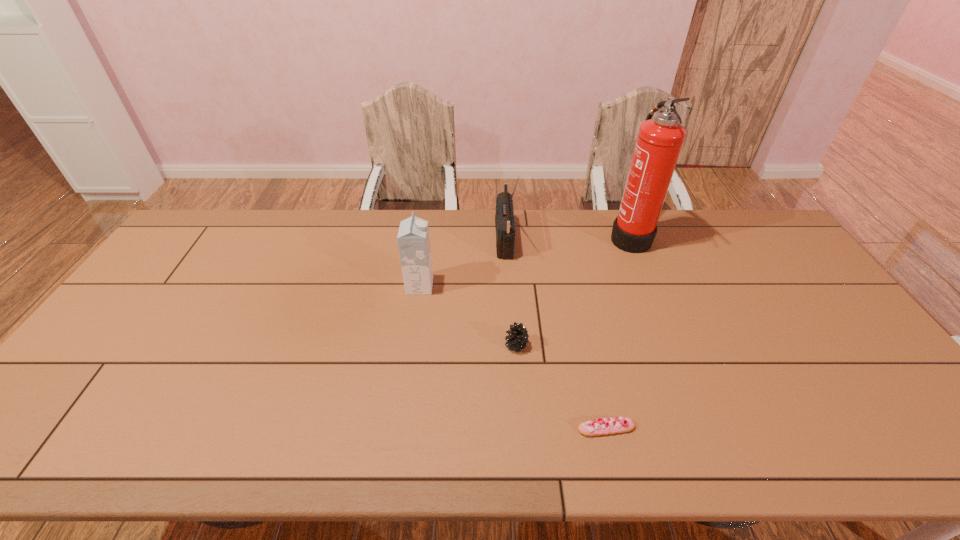
You are a GUI agent. You are given a task and a screenshot of the screen. Output one action in this format:
    pyautogui.click(x=<x>, y=<y>)
    Task: Click on the rightmost object
    The height and width of the screenshot is (540, 960).
    Given the screenshot: What is the action you would take?
    pyautogui.click(x=659, y=142)

The height and width of the screenshot is (540, 960). What are the coordinates of `the tallest object` in the screenshot? It's located at (659, 142).

What are the coordinates of `the fourth shortest object` in the screenshot? It's located at (504, 219).

Find the location of a particular element. This screenshot has width=960, height=540. carton is located at coordinates (413, 238).

This screenshot has height=540, width=960. Find the location of `the leftmost object`. the leftmost object is located at coordinates (413, 238).

At what (x,y) coordinates should I click in order to perform the action: click on pinecone. Please return your answer as a coordinate pair (x, y). The width and height of the screenshot is (960, 540). Looking at the image, I should click on (517, 338).

The width and height of the screenshot is (960, 540). I want to click on the fourth tallest object, so click(x=517, y=338).

This screenshot has height=540, width=960. What are the coordinates of `the shortest object` in the screenshot? It's located at (602, 426).

I want to click on eclair, so click(602, 426).

The image size is (960, 540). What are the coordinates of `vacant space located 0.160m on the front-facing side of the fire extinguisher` in the screenshot? It's located at (563, 236).